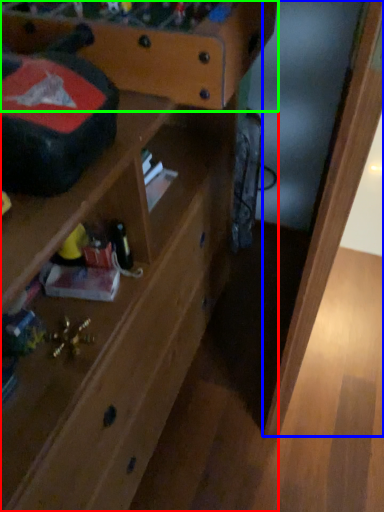
Question: Which object is the farthest from shelf (highlighted by a red box)? Choose among these: wood (highlighted by a blue box) or writing desk (highlighted by a green box).

Choices:
 (A) wood
 (B) writing desk

Answer: (A)